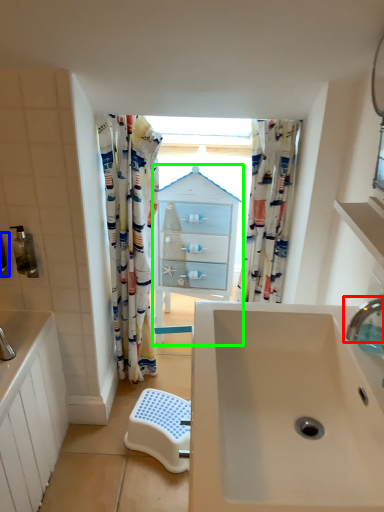
Question: Which object is the farthest from tap (highlighted by a red box)? Choose among these: toiletry (highlighted by a blue box) or medicine cabinet (highlighted by a green box).

Choices:
 (A) toiletry
 (B) medicine cabinet

Answer: (A)